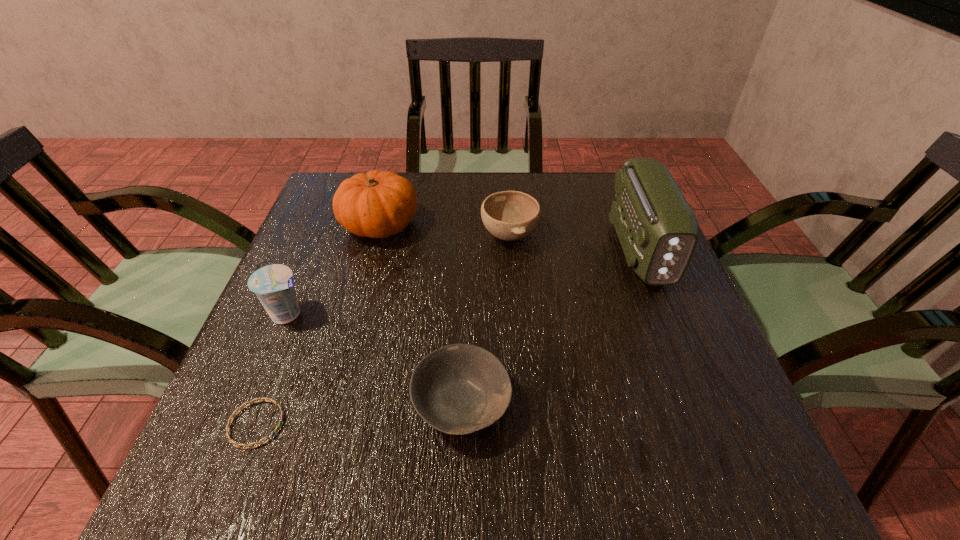
You are a GUI agent. You are given a task and a screenshot of the screen. Output one action in this format:
    pyautogui.click(x=<x>, y=<y>)
    Task: Click on the free space located on the front-facing side of the rightmost object
    
    Given the screenshot: What is the action you would take?
    pyautogui.click(x=671, y=328)

Image resolution: width=960 pixels, height=540 pixels. I want to click on vacant region located 0.100m on the right of the pumpkin, so click(x=459, y=225).

Locate an element on the screen. free location located on the right of the third tallest object is located at coordinates click(450, 314).

Identify the location of free region located on the front of the taller bowl. (516, 322).

The height and width of the screenshot is (540, 960). I want to click on blank space located 0.290m on the back of the nearer bowl, so click(467, 260).

Find the location of a particular element. The height and width of the screenshot is (540, 960). vacant space situated 0.320m on the surface of the shortest object showing star-shaped elements is located at coordinates (473, 424).

In order to click on radio_receiver at the far edge in this screenshot , I will do `click(658, 231)`.

Image resolution: width=960 pixels, height=540 pixels. Find the location of `pumpkin that is positioned at the far edge`. pumpkin that is positioned at the far edge is located at coordinates (377, 204).

The image size is (960, 540). I want to click on bowl at the far edge, so click(508, 215).

Locate an element on the screen. This screenshot has height=540, width=960. bowl at the near edge is located at coordinates (458, 389).